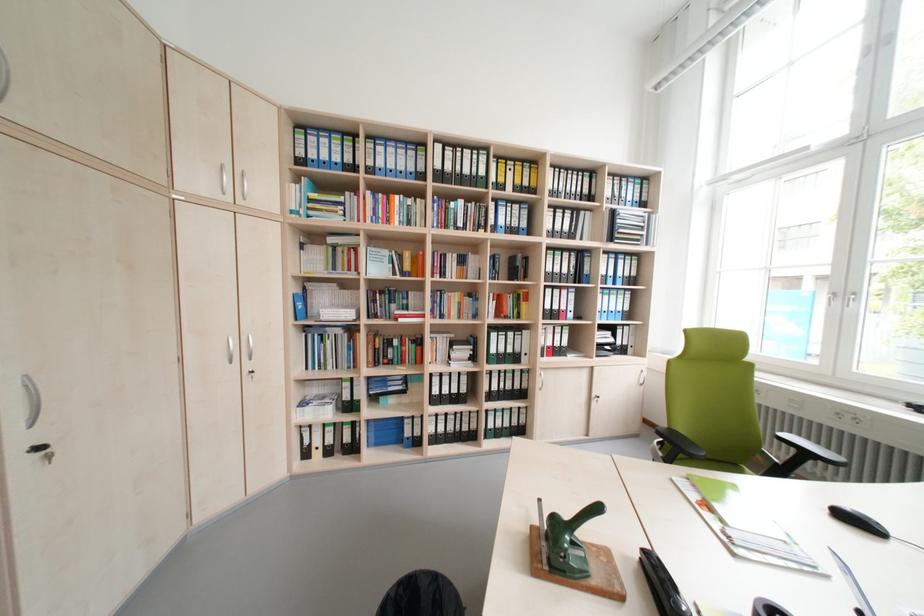
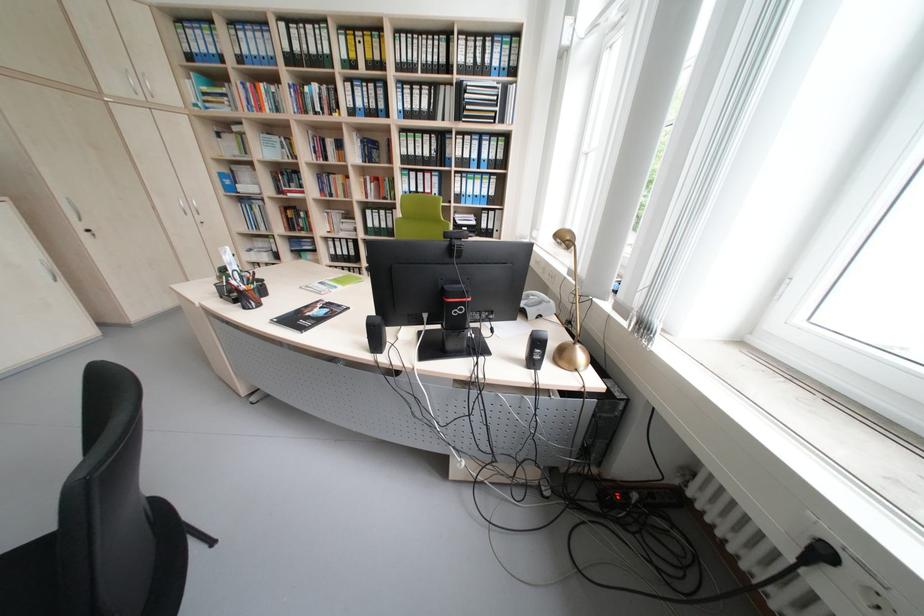
Where in the second image is the point corresponding to (x=398, y=344) from the first image?

(309, 217)